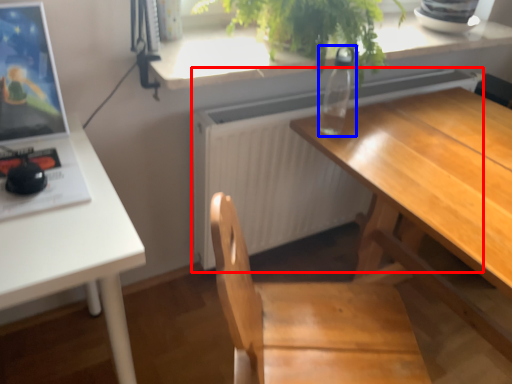
Question: Which object is closer to the camera taking this photo, radiator (highlighted by a red box) or bottle (highlighted by a blue box)?

Choices:
 (A) radiator
 (B) bottle

Answer: (B)